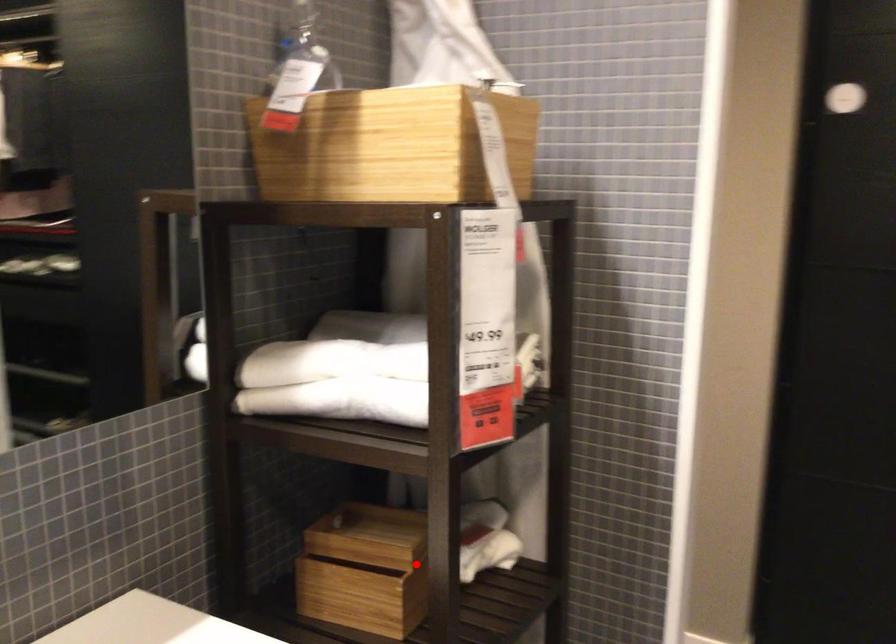
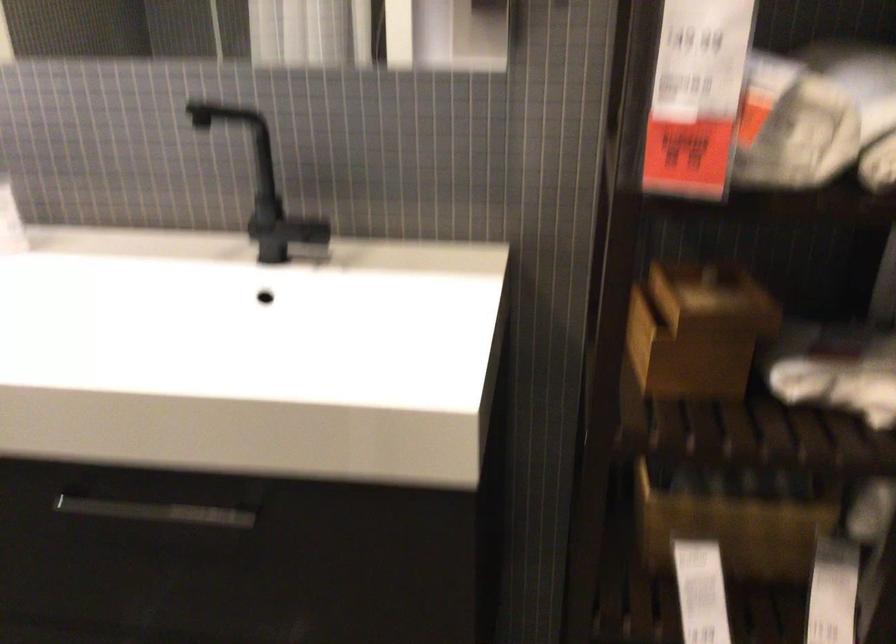
Question: A red point is marked in image1. In image2, is the corresponding 3D point closer to the camera or farther? Reply with the corresponding letter.

Choices:
 (A) The corresponding 3D point is closer.
 (B) The corresponding 3D point is farther.

Answer: (A)